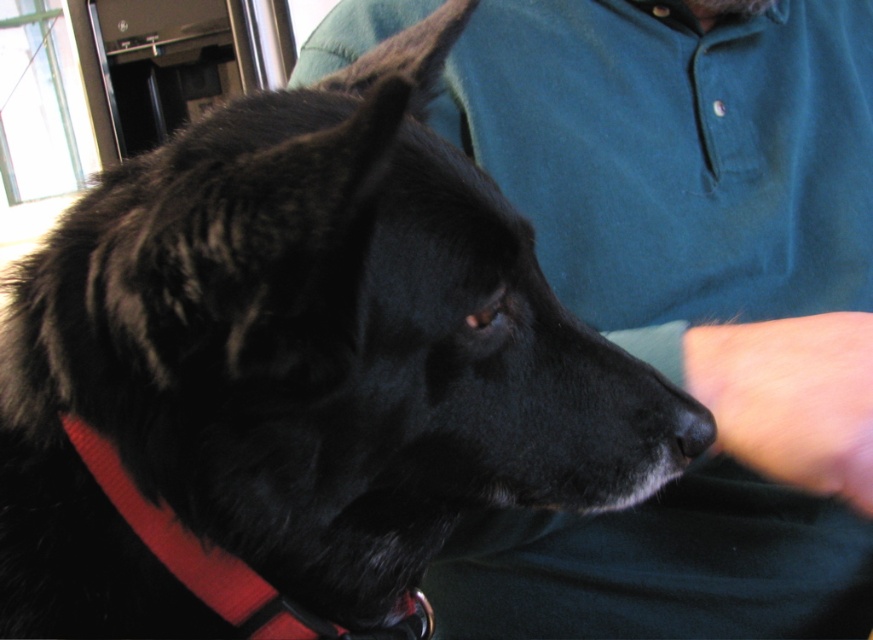
Question: Does green cotton shirt at upper center appear on the right side of smooth skin at lower right?

Choices:
 (A) no
 (B) yes

Answer: (A)

Question: Is green cotton shirt at upper center below smooth skin at lower right?

Choices:
 (A) no
 (B) yes

Answer: (A)

Question: Observing the image, what is the correct spatial positioning of green cotton shirt at upper center in reference to smooth skin at lower right?

Choices:
 (A) above
 (B) below

Answer: (A)

Question: Which object is the closest to the red nylon collar at lower left?

Choices:
 (A) green cotton shirt at upper center
 (B) smooth skin at lower right

Answer: (B)

Question: Which of the following is the closest to the observer?

Choices:
 (A) green cotton shirt at upper center
 (B) red nylon collar at lower left
 (C) smooth skin at lower right

Answer: (B)

Question: Which of these objects is positioned farthest from the red nylon collar at lower left?

Choices:
 (A) smooth skin at lower right
 (B) green cotton shirt at upper center

Answer: (B)